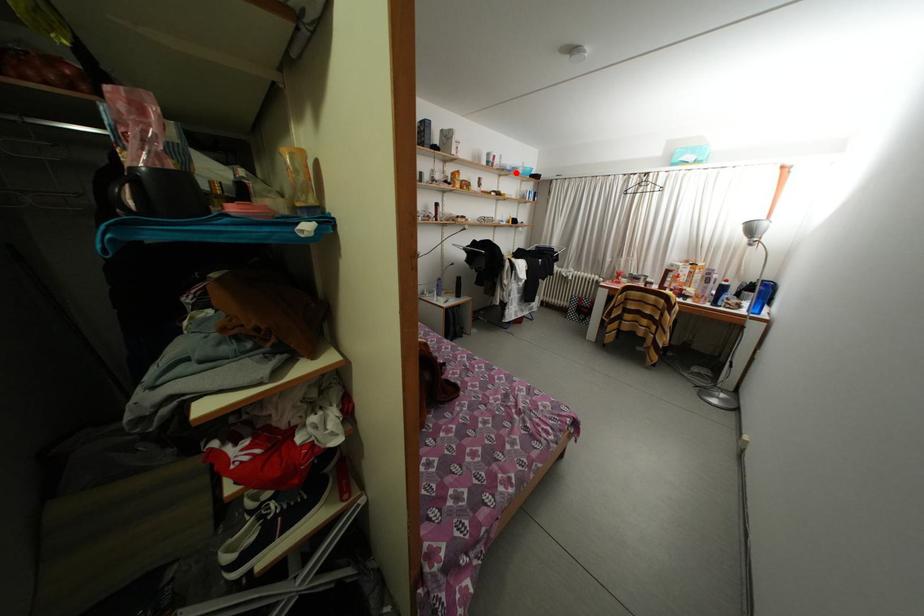
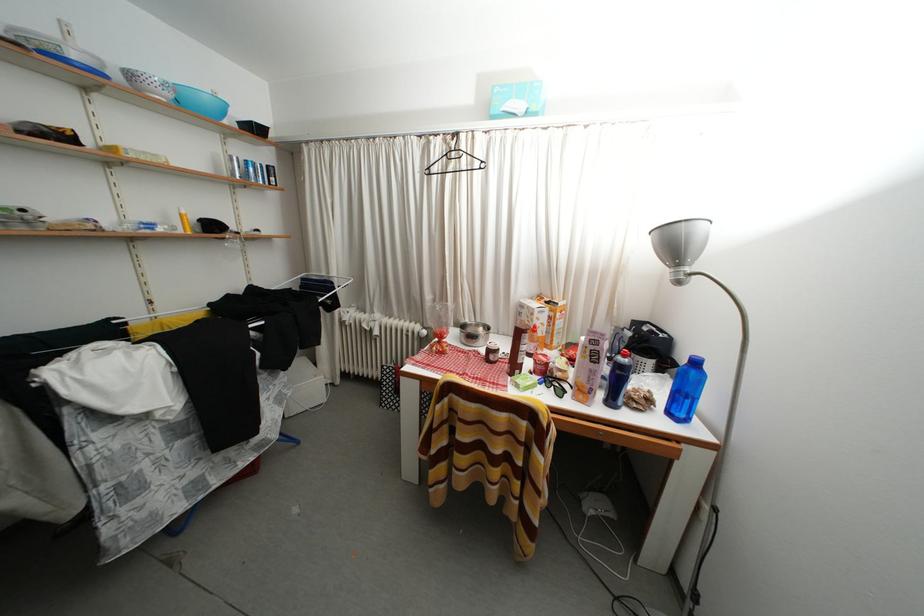
Find the pixel in the second image that matches the highlighted location in the first image.

(81, 61)